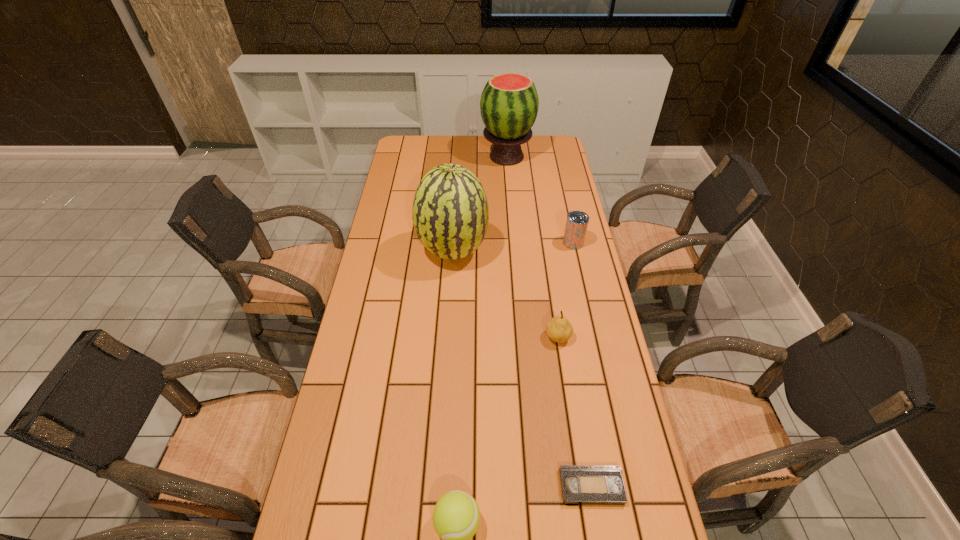
Locate an element on the screen. the farther watermelon is located at coordinates (509, 103).

In order to click on the nearer watermelon in this screenshot , I will do `click(450, 214)`.

Locate an element on the screen. The width and height of the screenshot is (960, 540). beer can is located at coordinates (576, 225).

Where is `the fourth farthest object`? the fourth farthest object is located at coordinates (559, 329).

Where is `videotape`? Image resolution: width=960 pixels, height=540 pixels. videotape is located at coordinates (581, 484).

Image resolution: width=960 pixels, height=540 pixels. I want to click on vacant region located 0.080m on the right of the farther watermelon, so click(551, 157).

Find the location of a particular element. The height and width of the screenshot is (540, 960). free space located 0.050m on the right of the nearer watermelon is located at coordinates (502, 252).

I want to click on vacant region located 0.370m on the front of the beer can, so click(592, 331).

The image size is (960, 540). Identify the location of free spot located 0.280m on the back of the fourth farthest object. (547, 264).

The image size is (960, 540). In order to click on free spot located 0.270m on the left of the videotape in this screenshot , I will do `click(446, 487)`.